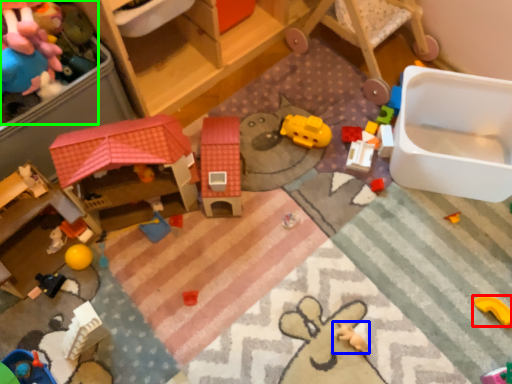
Question: Based on their relative distances, which object is farther from toy (highlighted by a red box)? Choose from toy (highlighted by a blue box) and toy (highlighted by a green box).

Choices:
 (A) toy
 (B) toy

Answer: (B)